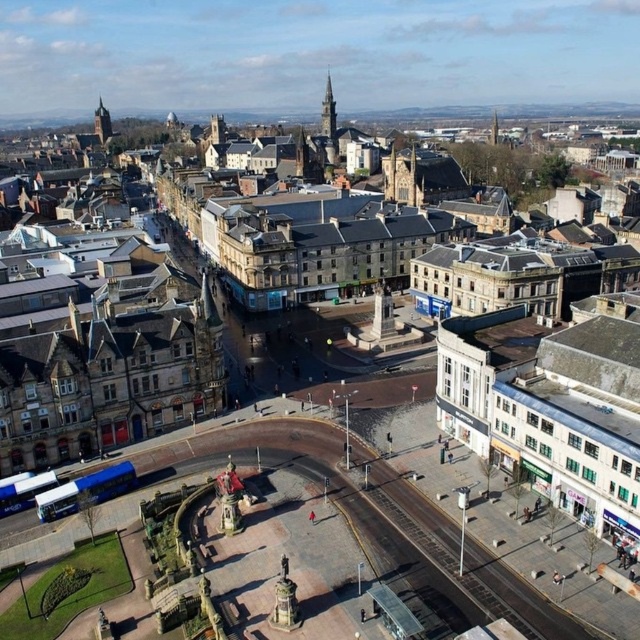
Is brown stone town at center closer to camera compared to smooth stone tower at upper center?

Yes, it is.

Does point (198, 225) come closer to viewer compared to point (324, 93)?

That is True.

The height and width of the screenshot is (640, 640). Find the location of `brown stone town at center`. brown stone town at center is located at coordinates (109, 371).

Is point (321, 115) positioned before point (108, 113)?

That is False.

Between smooth stone tower at upper center and dark brown stone tower at upper left, which one is positioned higher?

smooth stone tower at upper center is above.

Which is in front, point (326, 100) or point (102, 132)?

Point (326, 100) is in front.

Identify the location of smooth stone tower at upper center. This screenshot has height=640, width=640. (328, 113).

Does point (60, 278) come in front of point (109, 125)?

Yes, it is in front of point (109, 125).

Is brown stone town at center below dark brown stone tower at upper left?

Indeed, brown stone town at center is positioned under dark brown stone tower at upper left.

Between point (54, 454) and point (104, 116), which one is positioned behind?

Positioned behind is point (104, 116).

You are a GUI agent. You are given a task and a screenshot of the screen. Output one action in this format:
    pyautogui.click(x=<x>, y=<y>)
    Task: Click on the brown stone town at center
    This screenshot has height=640, width=640.
    Given the screenshot: What is the action you would take?
    pyautogui.click(x=109, y=371)